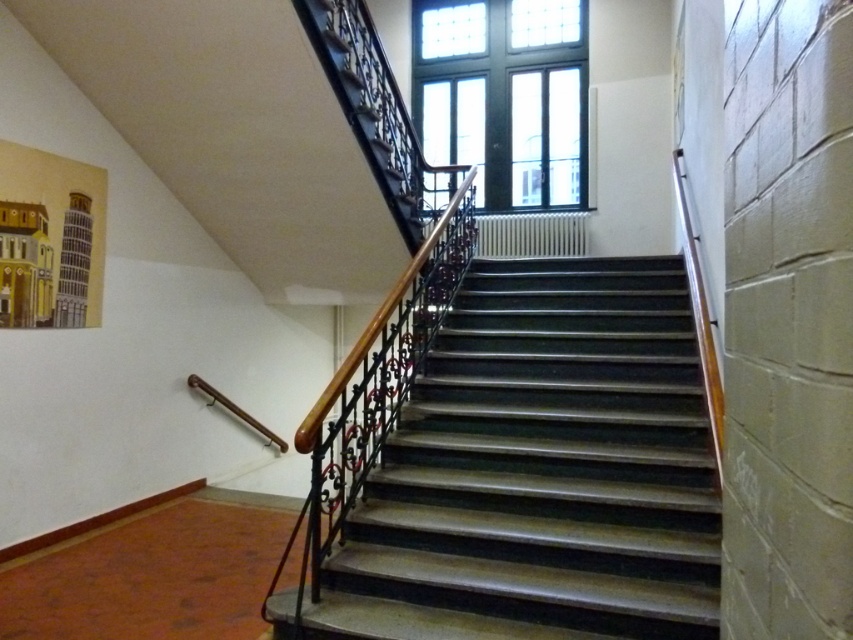
Is point (431, 540) closer to viewer compared to point (430, 60)?

Yes, it is.

Is point (485, 596) positioned behind point (479, 198)?

No, it is in front of (479, 198).

Image resolution: width=853 pixels, height=640 pixels. I want to click on shiny dark wood stairs at center, so click(x=541, y=468).